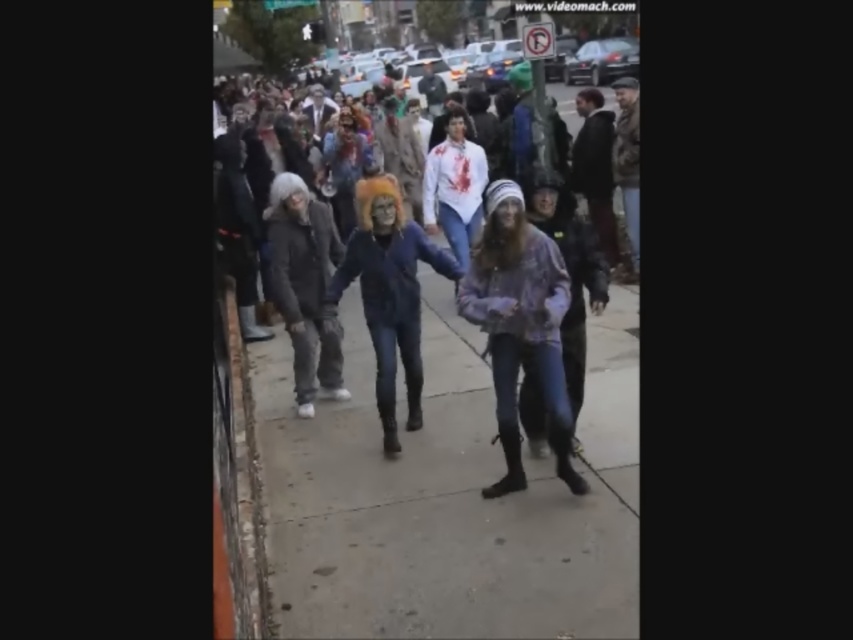
In the scene shown: You are standing at the point marked as point (612, 397) in the image. What object are you touching?

The point (612, 397) is on the denim jacket at center, so you are touching the denim jacket at center.

You are a photographer standing at the edge of the sidewalk, wanting to capture a photo of the denim jacket at center and the plaid fabric jacket at center without any obstruction. Given that your camera has a maximum focus range of 1.6 meters, will you be able to include both jackets in the frame clearly?

The distance between the denim jacket at center and the plaid fabric jacket at center is 1.70 meters, which exceeds the camera maximum focus range of 1.6 meters. Therefore, you cannot include both jackets in the frame clearly.

Please provide the 2D coordinates of the denim jacket at center in the image. The coordinates should be in the format of a point with two decimal places, such as point 0.5,0.5.

The denim jacket at center is located at point (612,397).